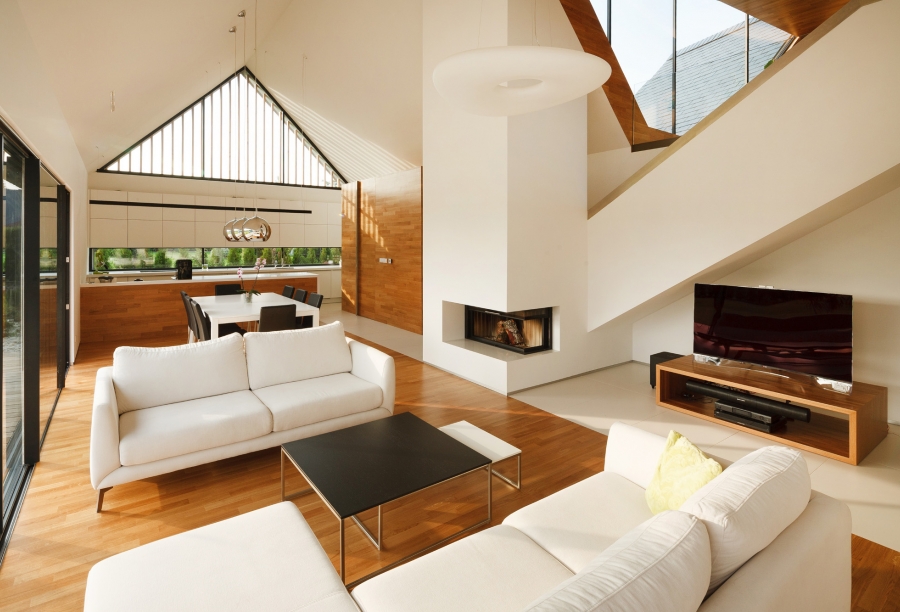
Find the location of `fireplace`. fireplace is located at coordinates (505, 337).